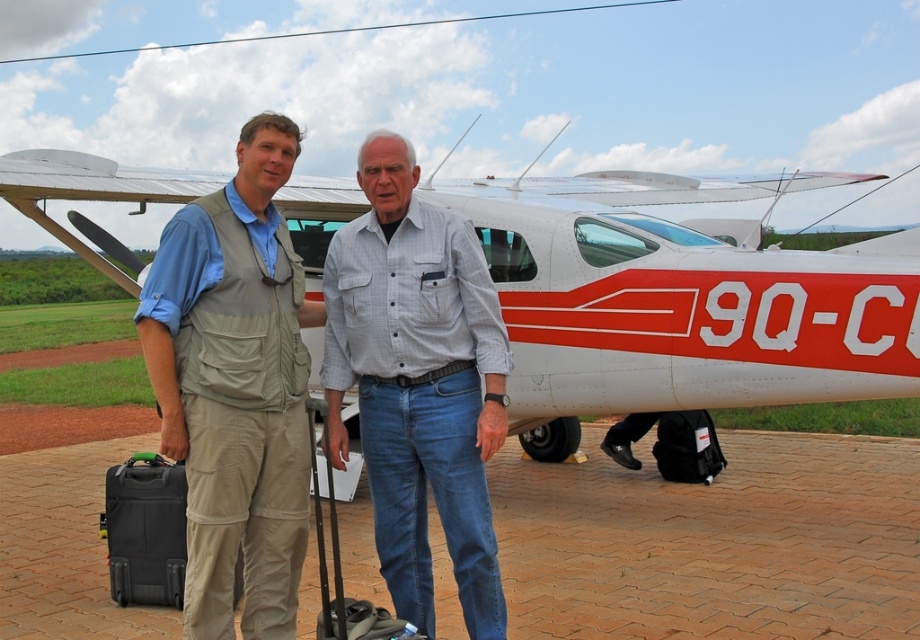
Question: Does white matte airplane at center have a lesser width compared to black hardshell suitcase at lower left?

Choices:
 (A) no
 (B) yes

Answer: (A)

Question: Considering the real-world distances, which object is farthest from the gray cotton shirt at center?

Choices:
 (A) khaki fabric vest at center
 (B) white matte airplane at center
 (C) denim suitcase at lower center
 (D) black hardshell suitcase at lower left

Answer: (B)

Question: Which point is farther from the camera taking this photo?

Choices:
 (A) (389, 424)
 (B) (315, 412)
 (C) (248, 548)

Answer: (A)

Question: Can you confirm if khaki fabric vest at center is thinner than gray cotton shirt at center?

Choices:
 (A) yes
 (B) no

Answer: (A)

Question: Which point is farther to the camera?

Choices:
 (A) khaki fabric vest at center
 (B) black hardshell suitcase at lower left

Answer: (B)

Question: Can you confirm if black hardshell suitcase at lower left is thinner than denim suitcase at lower center?

Choices:
 (A) yes
 (B) no

Answer: (B)